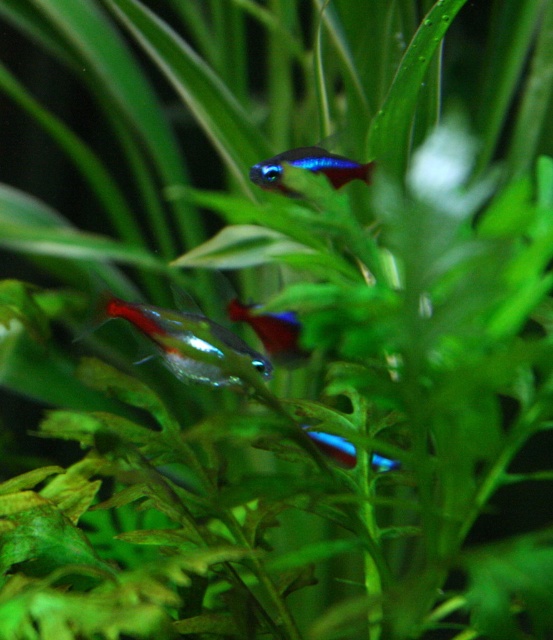
Who is lower down, shiny blue glass fish at center or blue glossy neon fish at center?

blue glossy neon fish at center is lower down.

Can you confirm if shiny blue glass fish at center is shorter than blue glossy neon fish at center?

Incorrect, shiny blue glass fish at center's height does not fall short of blue glossy neon fish at center's.

Who is more distant from viewer, (298, 157) or (373, 458)?

Positioned behind is point (298, 157).

Identify the location of shiny blue glass fish at center. The height and width of the screenshot is (640, 553). (307, 168).

What do you see at coordinates (180, 339) in the screenshot?
I see `translucent glass fish at center` at bounding box center [180, 339].

Does translucent glass fish at center have a greater height compared to shiny blue glass fish at center?

Yes, translucent glass fish at center is taller than shiny blue glass fish at center.

Between point (216, 374) and point (293, 193), which one is positioned in front?

Point (293, 193)

This screenshot has height=640, width=553. I want to click on translucent glass fish at center, so click(x=180, y=339).

Which is in front, point (327, 157) or point (264, 314)?

Point (327, 157) is more forward.

Can you confirm if shiny blue glass fish at center is wider than shiny blue and red fish at center?

Yes, shiny blue glass fish at center is wider than shiny blue and red fish at center.

This screenshot has height=640, width=553. Describe the element at coordinates (307, 168) in the screenshot. I see `shiny blue glass fish at center` at that location.

The image size is (553, 640). In order to click on shiny blue glass fish at center in this screenshot , I will do `click(307, 168)`.